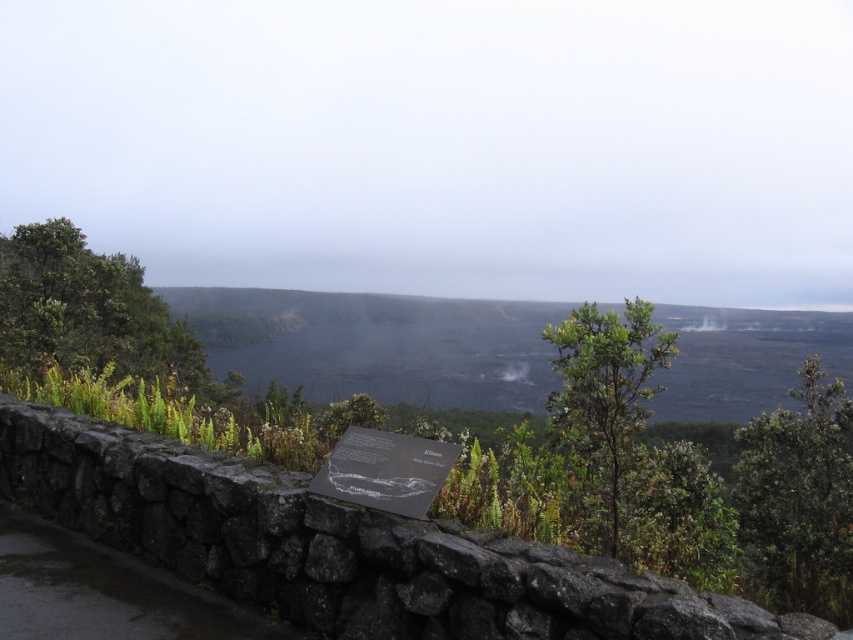
You are standing at the edge of a volcanic landscape and want to reach a specific point marked at coordinates (62,282). Given that you can walk 10 feet per minute, how many minutes will it take you to reach that point?

The point at (62,282) is 33.77 feet away from the viewer. At a walking speed of 10 feet per minute, it would take approximately 3.38 minutes to reach the point.

You are a park ranger assessing the vegetation in the volcanic landscape. You notice two green leafy shrubs at lower center and a green leafy shrub at center. Which of these shrubs has a greater width?

The green leafy shrubs at lower center has a greater width than the green leafy shrub at center.

You are standing at the edge of the volcanic landscape and see the green leafy shrubs at lower center and the green leafy shrub at center. Which shrub is closer to you?

The green leafy shrubs at lower center is closer to you because it is further to the viewer than the green leafy shrub at center.